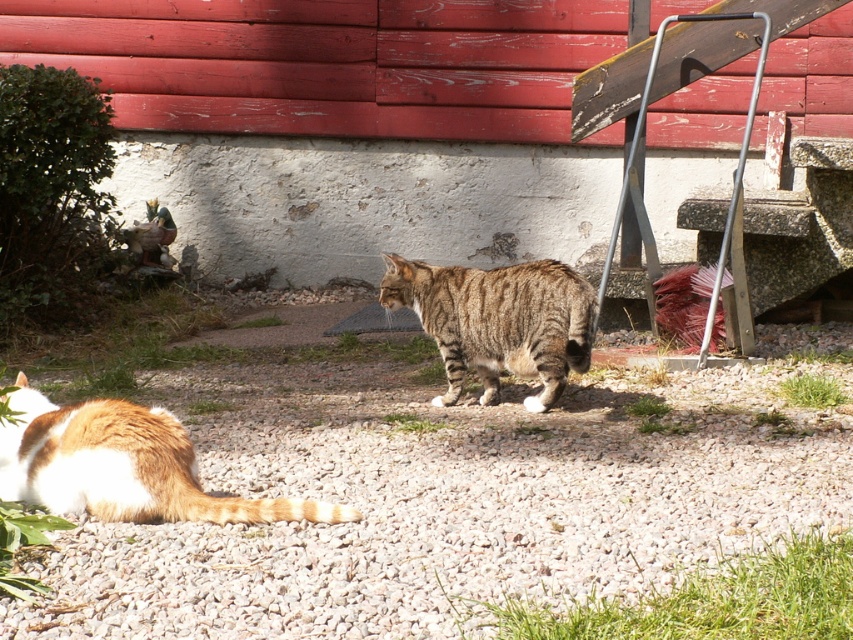
Is point (164, 380) positioned before point (54, 424)?

No.

Between point (451, 419) and point (30, 433), which one is positioned in front?

Point (30, 433)

The width and height of the screenshot is (853, 640). Describe the element at coordinates (454, 493) in the screenshot. I see `gray gravel at center` at that location.

At what (x,y) coordinates should I click in order to perform the action: click on gray gravel at center. Please return your answer as a coordinate pair (x, y). This screenshot has height=640, width=853. Looking at the image, I should click on pyautogui.click(x=454, y=493).

Who is more forward, (126, 413) or (496, 384)?

Point (126, 413) is in front.

Between orange-white fur cat at lower left and tabby fur cat at center, which one has less height?

orange-white fur cat at lower left

Locate an element on the screen. orange-white fur cat at lower left is located at coordinates (122, 465).

The width and height of the screenshot is (853, 640). What are the coordinates of `orange-white fur cat at lower left` in the screenshot? It's located at (122, 465).

The image size is (853, 640). What are the coordinates of `gray gravel at center` in the screenshot? It's located at (454, 493).

Between gray gravel at center and tabby fur cat at center, which one is positioned higher?

tabby fur cat at center is above.

In order to click on gray gravel at center in this screenshot , I will do `click(454, 493)`.